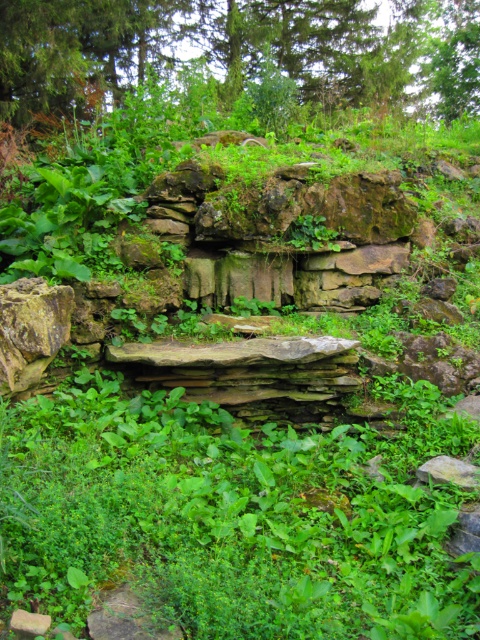
You are a gardener who wants to plant a new flower bed between the green leafy grass at center and the green leafy tree at upper center. Which object should you consider for space availability based on their heights?

The green leafy grass at center is taller than the green leafy tree at upper center. Therefore, you should consider the green leafy tree at upper center for space availability since it is shorter, allowing more vertical space for the new flower bed.

You are a gardener standing in front of the stone structure. You need to place a new decorative rock between the green leafy grass at center and the green leafy tree at upper center. Where should you place it to ensure it is between them?

The green leafy grass at center is to the left of the green leafy tree at upper center, so placing the decorative rock between them would require positioning it to the right of the green leafy grass at center and to the left of the green leafy tree at upper center.